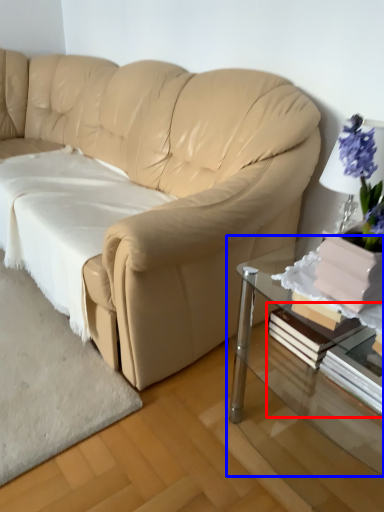
Question: Which point is closer to the camera, book (highlighted by a red box) or table (highlighted by a blue box)?

Choices:
 (A) book
 (B) table

Answer: (B)